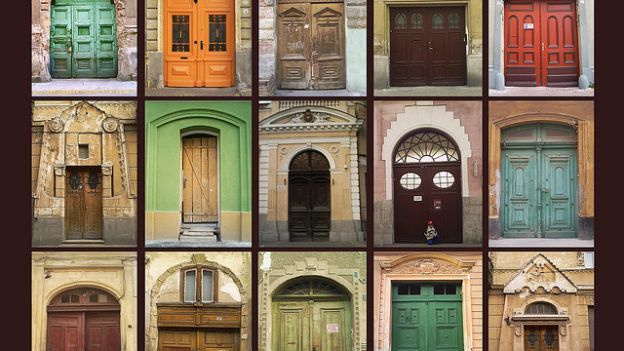
I want to click on doors in the middle and bottom rows, so click(87, 311), click(210, 315), click(95, 196), click(205, 192), click(300, 179), click(322, 302), click(435, 293), click(432, 187), click(542, 171), click(551, 312).